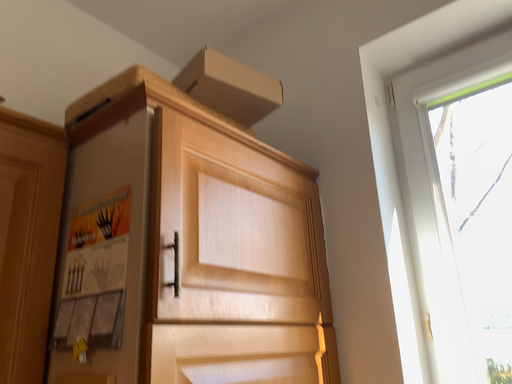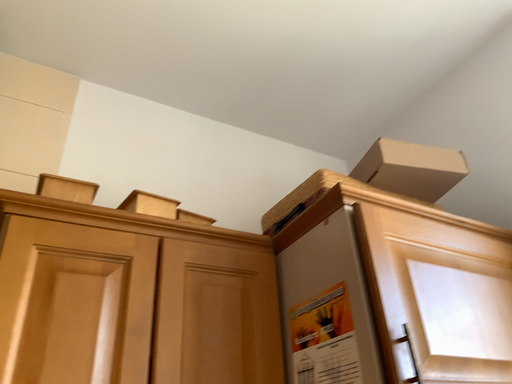
Question: How did the camera likely rotate when shooting the video?

Choices:
 (A) rotated upward
 (B) rotated downward

Answer: (A)